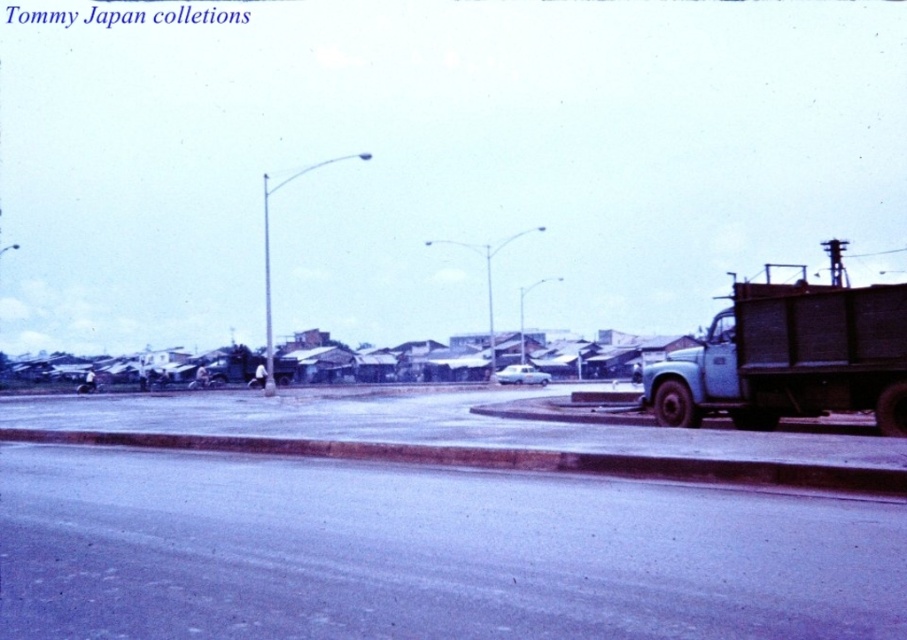
Question: Is blue matte truck at right above white glossy car at center?

Choices:
 (A) no
 (B) yes

Answer: (B)

Question: Is blue matte truck at right thinner than white glossy car at center?

Choices:
 (A) yes
 (B) no

Answer: (B)

Question: Which object is positioned farthest from the white glossy car at center?

Choices:
 (A) smooth concrete curb at lower center
 (B) blue matte truck at right

Answer: (A)

Question: Can you confirm if blue matte truck at right is bigger than white glossy car at center?

Choices:
 (A) yes
 (B) no

Answer: (B)

Question: Based on their relative distances, which object is farther from the white glossy car at center?

Choices:
 (A) blue matte truck at right
 (B) smooth concrete curb at lower center

Answer: (B)

Question: Estimate the real-world distances between objects in this image. Which object is farther from the blue matte truck at right?

Choices:
 (A) white glossy car at center
 (B) smooth concrete curb at lower center

Answer: (A)